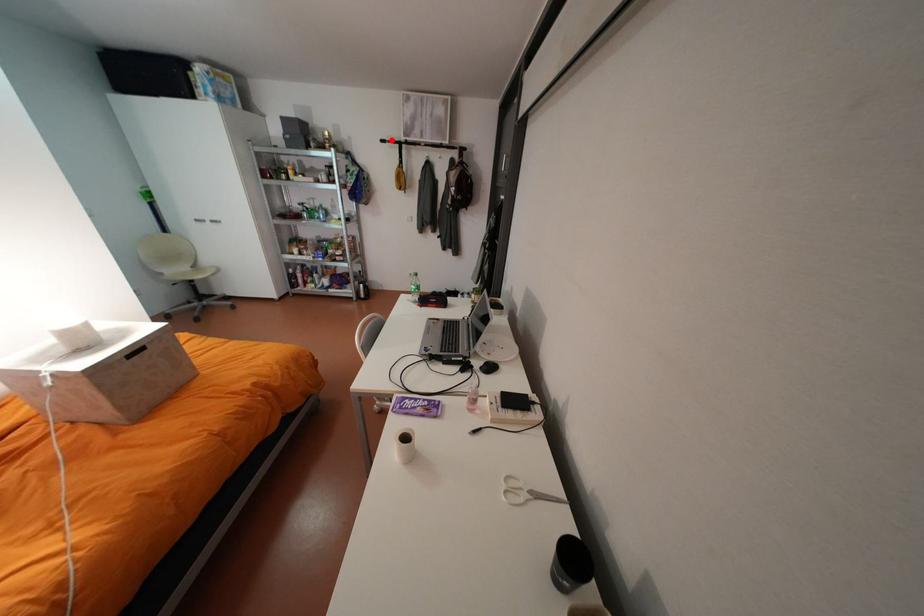
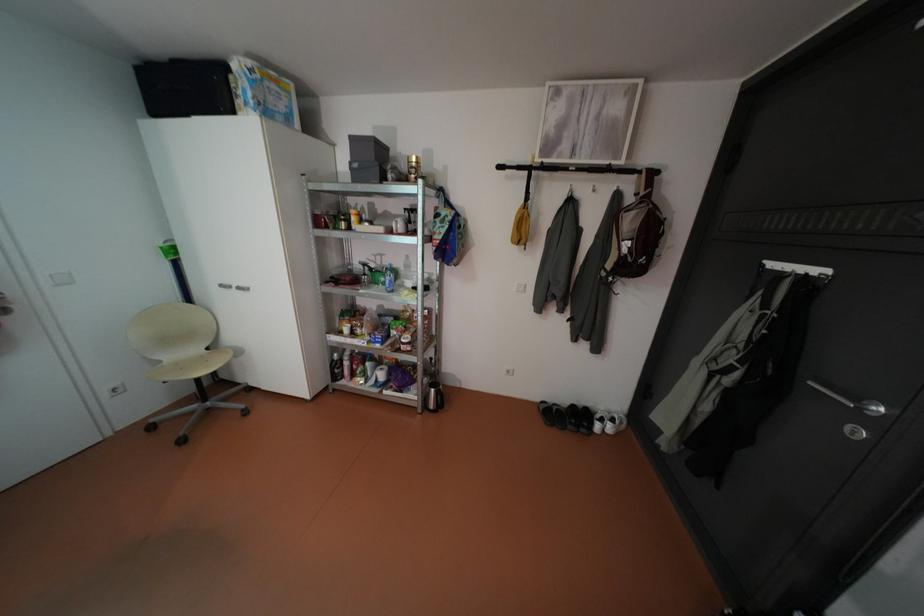
In the second image, find the point that corresponds to the highlighted location in the first image.

(508, 166)